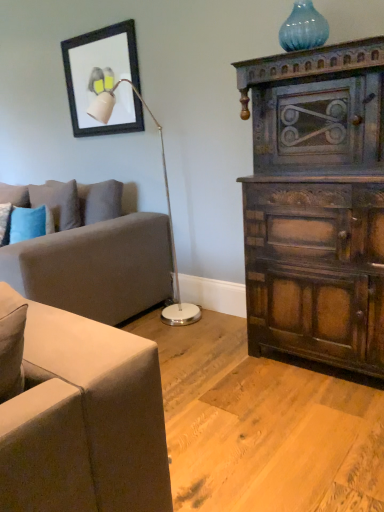
Question: Is dark wood cabinet at right located within soft gray fabric couch at left?

Choices:
 (A) no
 (B) yes

Answer: (A)

Question: Is soft gray fabric couch at left closer to camera compared to dark wood cabinet at right?

Choices:
 (A) no
 (B) yes

Answer: (A)

Question: From a real-world perspective, is soft gray fabric couch at left physically below dark wood cabinet at right?

Choices:
 (A) yes
 (B) no

Answer: (A)

Question: Can you confirm if soft gray fabric couch at left is wider than dark wood cabinet at right?

Choices:
 (A) no
 (B) yes

Answer: (B)

Question: Does soft gray fabric couch at left touch dark wood cabinet at right?

Choices:
 (A) yes
 (B) no

Answer: (B)

Question: Considering their positions, is blue glass vase at upper right located in front of or behind blue textured pillow at left?

Choices:
 (A) behind
 (B) front

Answer: (B)

Question: Does point (314, 14) appear closer or farther from the camera than point (59, 205)?

Choices:
 (A) farther
 (B) closer

Answer: (B)

Question: From the image's perspective, is blue glass vase at upper right located above or below blue textured pillow at left?

Choices:
 (A) below
 (B) above

Answer: (B)

Question: In terms of size, does blue glass vase at upper right appear bigger or smaller than blue textured pillow at left?

Choices:
 (A) small
 (B) big

Answer: (A)

Question: In terms of height, does matte black picture frame at upper left look taller or shorter compared to blue glass vase at upper right?

Choices:
 (A) tall
 (B) short

Answer: (A)

Question: Do you think matte black picture frame at upper left is within blue glass vase at upper right, or outside of it?

Choices:
 (A) inside
 (B) outside

Answer: (B)

Question: Is matte black picture frame at upper left wider or thinner than blue glass vase at upper right?

Choices:
 (A) thin
 (B) wide

Answer: (A)

Question: Is matte black picture frame at upper left in front of or behind blue glass vase at upper right in the image?

Choices:
 (A) behind
 (B) front

Answer: (A)

Question: Is matte black picture frame at upper left bigger or smaller than blue textured pillow at left?

Choices:
 (A) small
 (B) big

Answer: (A)

Question: Visually, is matte black picture frame at upper left positioned to the left or to the right of blue textured pillow at left?

Choices:
 (A) left
 (B) right

Answer: (B)